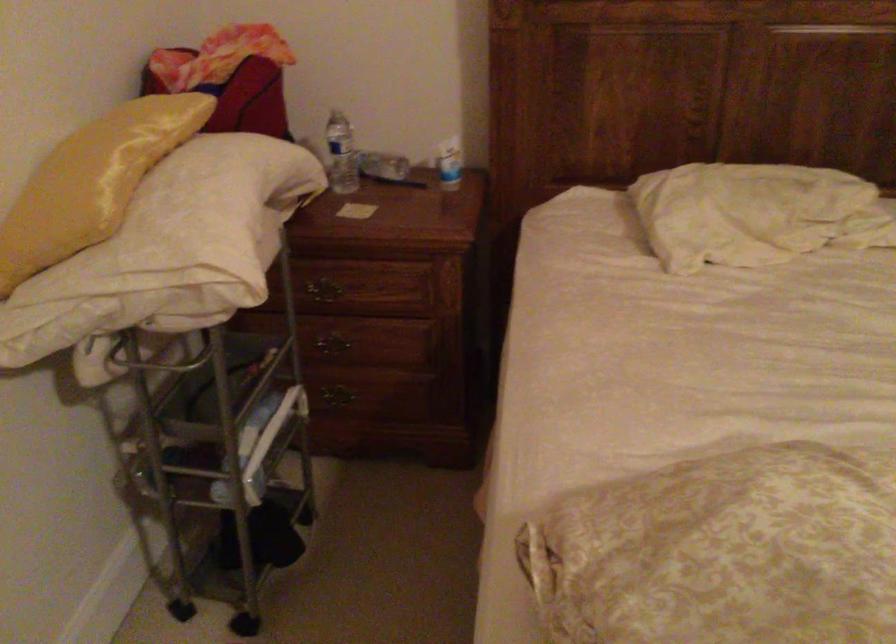
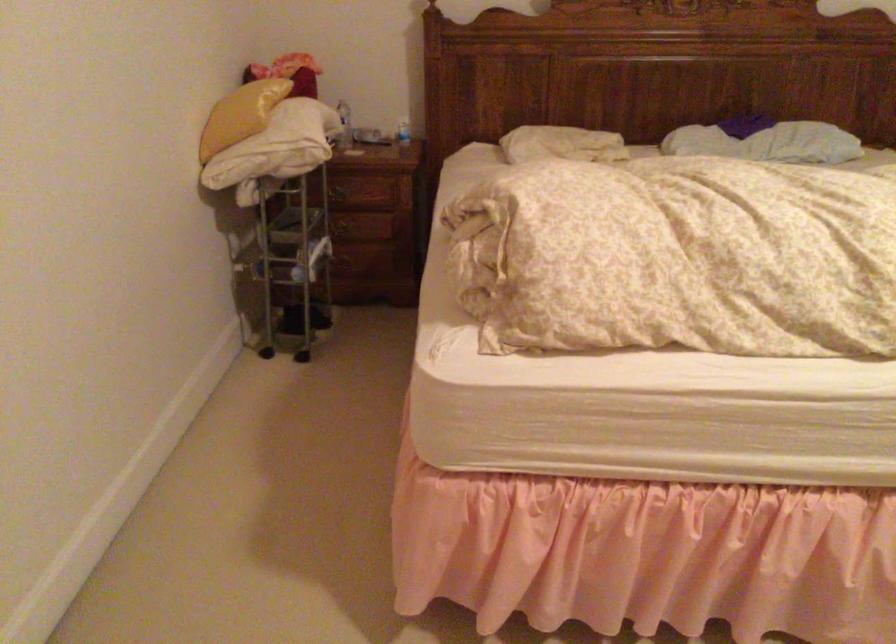
Find the pixel in the second image that matches [325,353] in the first image.

(342, 230)